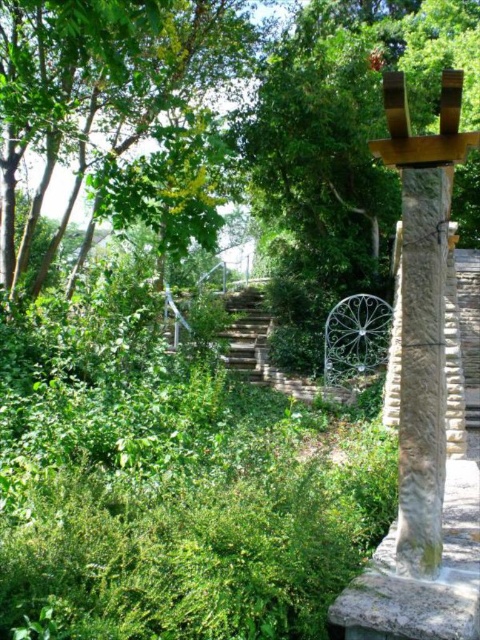
Question: Is green leafy tree at center closer to camera compared to smooth concrete stairs at center?

Choices:
 (A) no
 (B) yes

Answer: (A)

Question: Which object is closer to the camera taking this photo?

Choices:
 (A) smooth concrete stairs at center
 (B) gray stone pillar at right

Answer: (B)

Question: Does gray stone pillar at right come behind smooth concrete stairs at center?

Choices:
 (A) yes
 (B) no

Answer: (B)

Question: Which of the following is the closest to the observer?

Choices:
 (A) gray stone pillar at right
 (B) green leafy tree at center
 (C) smooth concrete stairs at center

Answer: (A)

Question: Where is green leafy tree at center located in relation to smooth concrete stairs at center in the image?

Choices:
 (A) right
 (B) left

Answer: (B)

Question: Which point is closer to the camera taking this photo?

Choices:
 (A) [x=414, y=550]
 (B) [x=388, y=170]
 (C) [x=474, y=330]

Answer: (A)